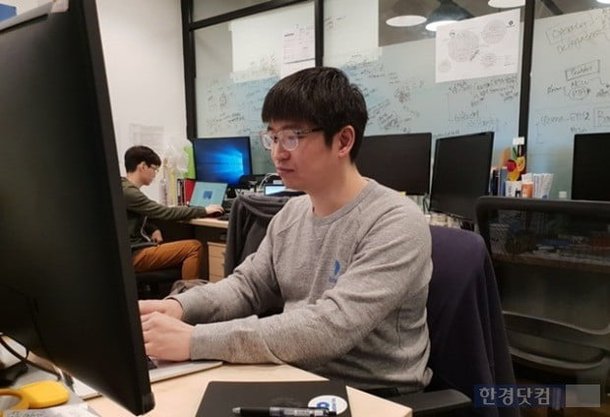
Find the location of `white board`. white board is located at coordinates (262, 73), (423, 78), (583, 83).